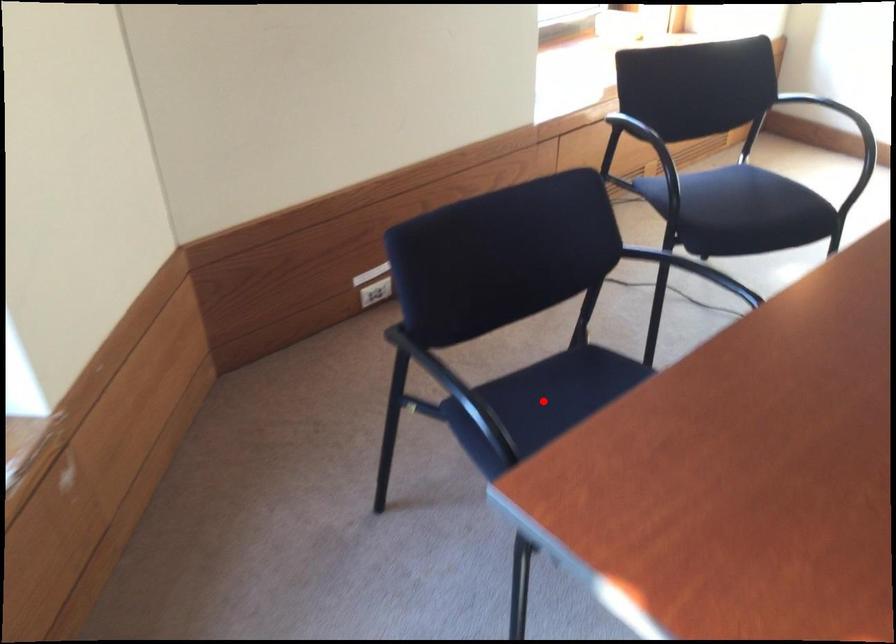
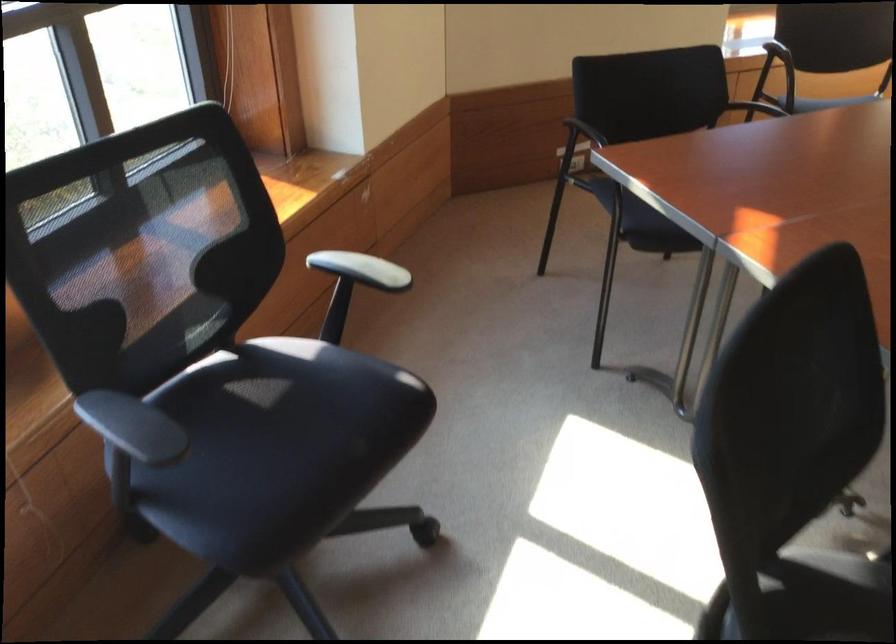
Question: I am providing you with two images of the same scene from different viewpoints. A red point is marked on the first image. At the location where the point appears in image 1, is it still visible in image 2?

Choices:
 (A) Yes
 (B) No

Answer: (B)